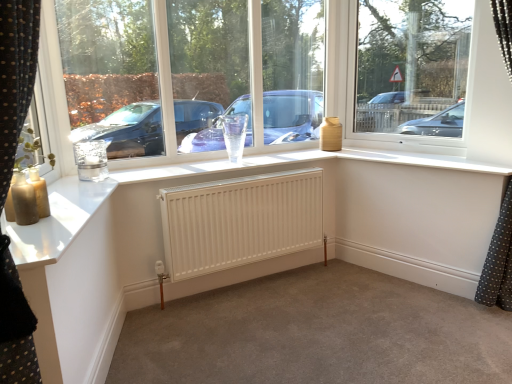
Question: Considering the positions of point [460, 51] and point [289, 76], is point [460, 51] closer or farther from the camera than point [289, 76]?

Choices:
 (A) closer
 (B) farther

Answer: (A)

Question: Considering the positions of transparent glass window at upper right and transparent glass vase at upper center in the image, is transparent glass window at upper right bigger or smaller than transparent glass vase at upper center?

Choices:
 (A) small
 (B) big

Answer: (A)

Question: Considering the real-world distances, which object is farthest from the transparent glass vase at upper center?

Choices:
 (A) transparent glass window at upper right
 (B) white matte radiator at center
 (C) white matte radiator at center
 (D) white matte radiator at center

Answer: (D)

Question: Estimate the real-world distances between objects in this image. Which object is closer to the white matte radiator at center?

Choices:
 (A) white matte radiator at center
 (B) white matte radiator at center
 (C) transparent glass window at upper right
 (D) transparent glass vase at upper center

Answer: (B)